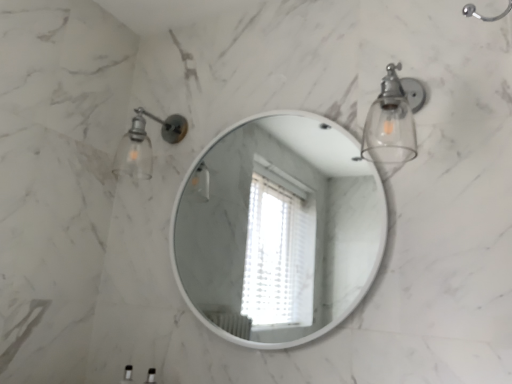
Question: Is clear glass sconce at upper right, which ranks as the second light fixture in back-to-front order, facing towards white glossy mirror at center?

Choices:
 (A) no
 (B) yes

Answer: (A)

Question: Is clear glass sconce at upper right, the first light fixture viewed from the right, facing away from white glossy mirror at center?

Choices:
 (A) yes
 (B) no

Answer: (B)

Question: From a real-world perspective, does clear glass sconce at upper right, which ranks as the second light fixture in back-to-front order, stand above white glossy mirror at center?

Choices:
 (A) no
 (B) yes

Answer: (B)

Question: Is clear glass sconce at upper right, placed as the first light fixture when sorted from front to back, positioned behind white glossy mirror at center?

Choices:
 (A) yes
 (B) no

Answer: (B)

Question: Is clear glass sconce at upper right, the first light fixture viewed from the right, at the right side of white glossy mirror at center?

Choices:
 (A) yes
 (B) no

Answer: (A)

Question: From their relative heights in the image, would you say clear glass sconce at upper right, placed as the second light fixture when sorted from left to right, is taller or shorter than matte glass sconce at upper left, which is counted as the 2th light fixture, starting from the front?

Choices:
 (A) short
 (B) tall

Answer: (B)

Question: From a real-world perspective, is clear glass sconce at upper right, the first light fixture viewed from the right, above or below matte glass sconce at upper left, acting as the 2th light fixture starting from the right?

Choices:
 (A) above
 (B) below

Answer: (B)

Question: In terms of width, does clear glass sconce at upper right, placed as the second light fixture when sorted from left to right, look wider or thinner when compared to matte glass sconce at upper left, the first light fixture when ordered from left to right?

Choices:
 (A) thin
 (B) wide

Answer: (A)

Question: In terms of size, does clear glass sconce at upper right, which ranks as the second light fixture in back-to-front order, appear bigger or smaller than matte glass sconce at upper left, which is counted as the 2th light fixture, starting from the front?

Choices:
 (A) small
 (B) big

Answer: (B)

Question: Based on their positions, is matte glass sconce at upper left, acting as the first light fixture starting from the back, located to the left or right of clear glass sconce at upper right, which ranks as the second light fixture in back-to-front order?

Choices:
 (A) left
 (B) right

Answer: (A)

Question: Is matte glass sconce at upper left, the first light fixture when ordered from left to right, wider or thinner than clear glass sconce at upper right, the first light fixture viewed from the right?

Choices:
 (A) wide
 (B) thin

Answer: (A)

Question: Based on their sizes in the image, would you say matte glass sconce at upper left, which is counted as the 2th light fixture, starting from the front, is bigger or smaller than clear glass sconce at upper right, the first light fixture viewed from the right?

Choices:
 (A) small
 (B) big

Answer: (A)

Question: Relative to clear glass sconce at upper right, placed as the second light fixture when sorted from left to right, is matte glass sconce at upper left, acting as the 2th light fixture starting from the right, in front or behind?

Choices:
 (A) behind
 (B) front

Answer: (A)

Question: From a real-world perspective, is clear glass sconce at upper right, placed as the second light fixture when sorted from left to right, physically located above or below white glossy mirror at center?

Choices:
 (A) below
 (B) above

Answer: (B)

Question: Choose the correct answer: Is clear glass sconce at upper right, which ranks as the second light fixture in back-to-front order, inside white glossy mirror at center or outside it?

Choices:
 (A) outside
 (B) inside

Answer: (A)